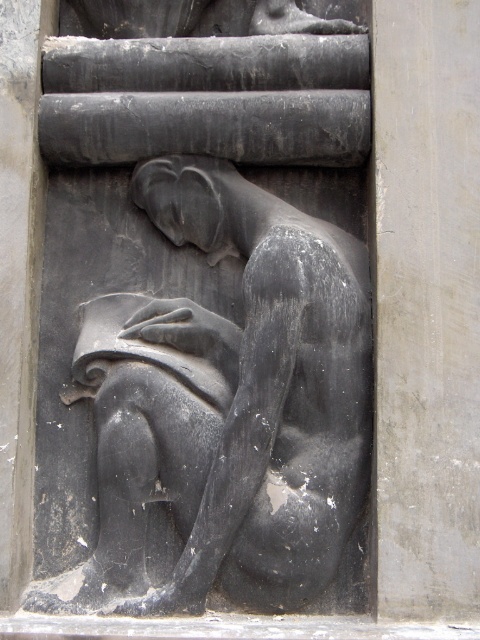
Between point (313, 218) and point (464, 125), which one is positioned in front?

Positioned in front is point (464, 125).

Between black stone sculpture at center and gray stone pillar at center, which one is positioned higher?

gray stone pillar at center is above.

Is point (180, 577) closer to viewer compared to point (455, 376)?

Yes, point (180, 577) is closer to viewer.

In order to click on black stone sculpture at center in this screenshot , I will do `click(229, 404)`.